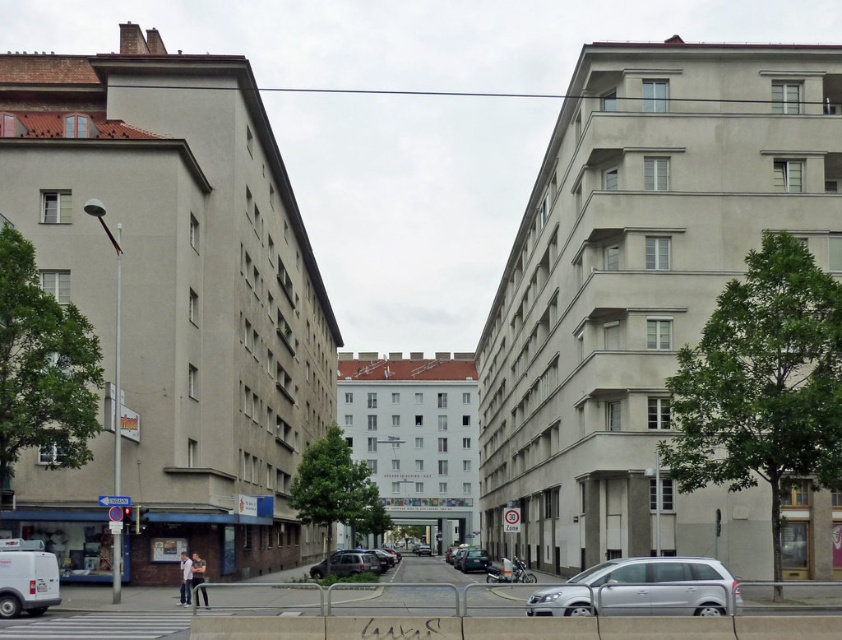
Based on the photo, you are a delivery person trying to park a van that is 2 meters tall. You see a matte black car at center and a metallic silver sedan at center in the parking area. Can you safely park your van between them without hitting the roof?

The matte black car at center is taller than the metallic silver sedan at center. Since your van is 2 meters tall, you need to ensure there is enough vertical space. However, since the matte black car at center is the tallest object here, if its height is more than 2 meters, parking might not be safe. But without specific height measurements, it is uncertain. However, according to the description, the matte black car at center has a greater height, but we don not know exact values. Therefore, it is risky to

You are a delivery driver who needs to park your 5.5 meter long truck between the silver metallic car at lower center and the matte black car at center. Can you fit your truck in the space between them?

The distance between the silver metallic car at lower center and the matte black car at center is 24.70 meters. Since your truck is only 5.5 meters long, there is more than enough space to park it between them.

Consider the image. You are a delivery driver approaching the urban street scene described. You need to park your silver metallic car at lower center near the building on the left. Given the lamppost and small tree in front of the left building, can you estimate if there is enough space to park the car without blocking the lamppost or the tree?

The silver metallic car at lower center is located at point coordinates that suggest it can be parked near the building on the left without blocking the lamppost or the small tree, as its position is clear of those obstacles according to the provided coordinates.